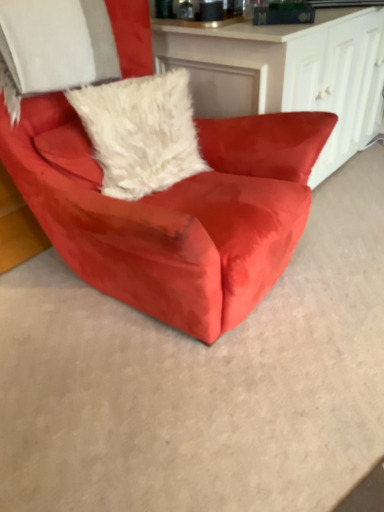
Question: Is point (283, 155) closer or farther from the camera than point (150, 76)?

Choices:
 (A) closer
 (B) farther

Answer: (A)

Question: From the image's perspective, is suede red armchair at center located above or below white fluffy pillow at center?

Choices:
 (A) above
 (B) below

Answer: (B)

Question: Is suede red armchair at center in front of or behind white fluffy pillow at center in the image?

Choices:
 (A) front
 (B) behind

Answer: (A)

Question: Is white fluffy pillow at center taller or shorter than suede red armchair at center?

Choices:
 (A) short
 (B) tall

Answer: (A)

Question: Relative to suede red armchair at center, is white fluffy pillow at center in front or behind?

Choices:
 (A) front
 (B) behind

Answer: (B)

Question: Would you say white fluffy pillow at center is to the left or to the right of suede red armchair at center in the picture?

Choices:
 (A) left
 (B) right

Answer: (A)

Question: In terms of width, does white fluffy pillow at center look wider or thinner when compared to suede red armchair at center?

Choices:
 (A) thin
 (B) wide

Answer: (A)